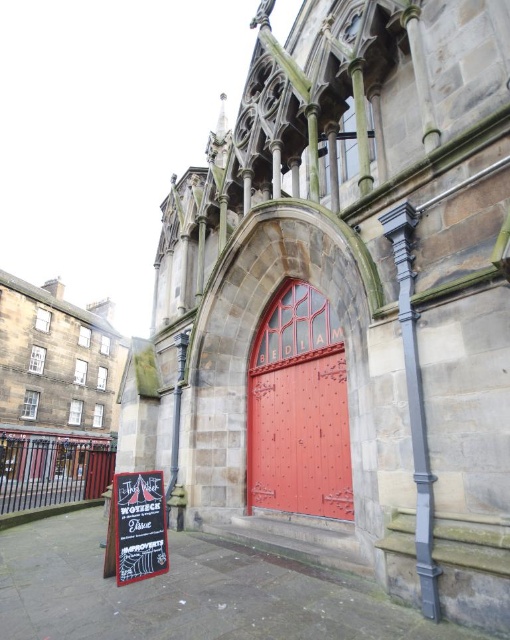
You are a visitor standing in front of the historic stone building. You notice both the smooth stone church at lower left and the glossy metal door at center. Which of these two objects is taller?

The smooth stone church at lower left is taller than the glossy metal door at center according to the description provided.

You are standing in front of the historic stone building and want to locate the glossy metal door at center. According to the coordinates provided, where should you look to find it?

The glossy metal door at center is located at the 2D coordinates point (299, 435).